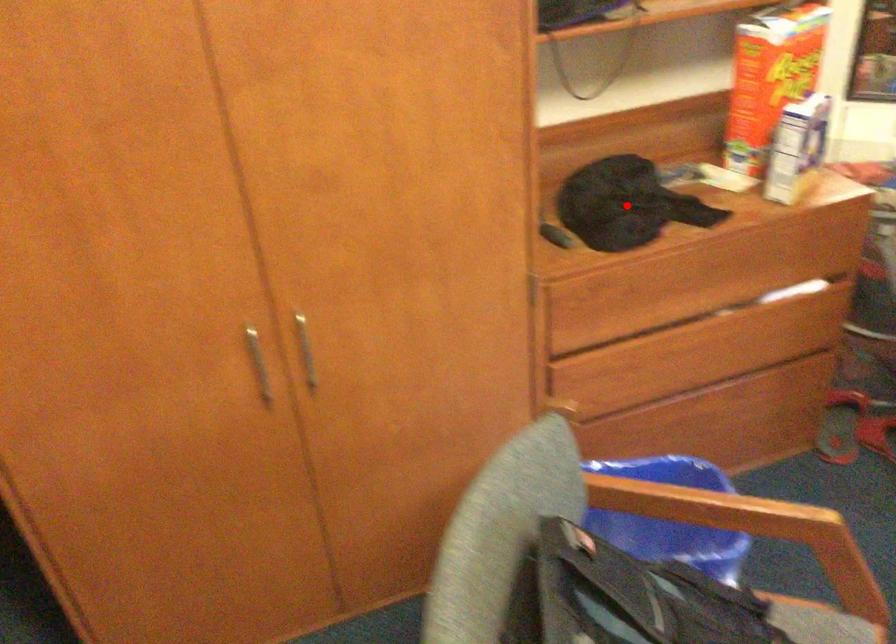
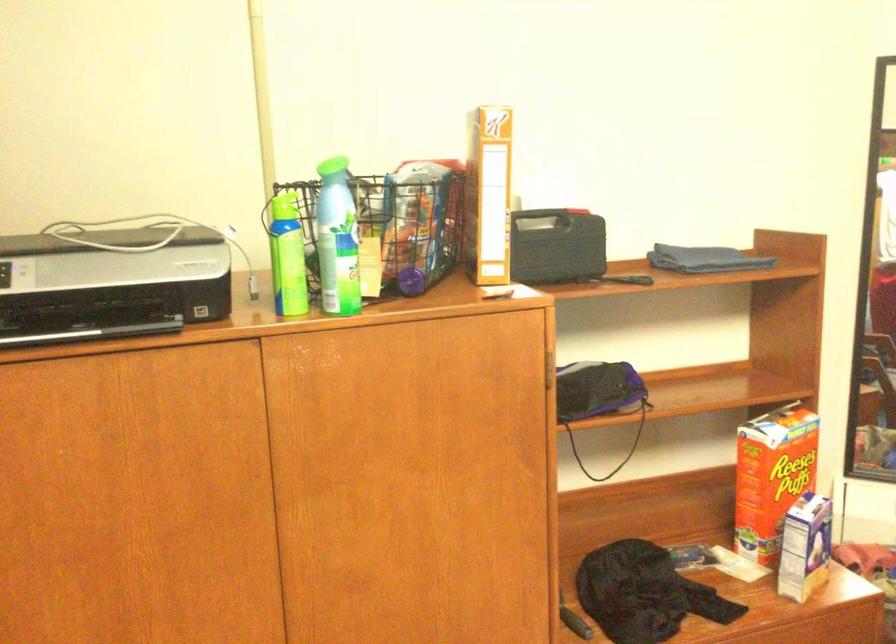
The point at the highlighted location is marked in the first image. Where is the corresponding point in the second image?

(643, 592)